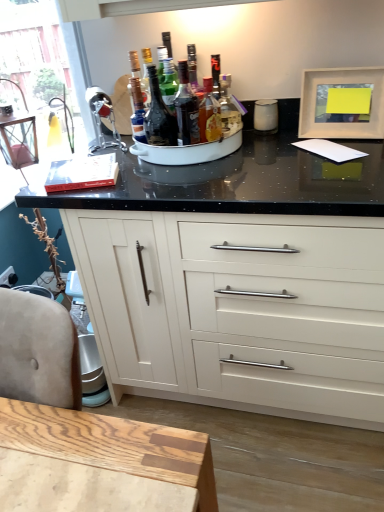
Question: Is translucent glass bottle at center, which is the 1th bottle in left-to-right order, at the left side of shiny dark glass bottle at center, marked as the second bottle in a left-to-right arrangement?

Choices:
 (A) yes
 (B) no

Answer: (A)

Question: Can we say translucent glass bottle at center, which is the 1th bottle in left-to-right order, lies outside shiny dark glass bottle at center, the second bottle positioned from the right?

Choices:
 (A) no
 (B) yes

Answer: (B)

Question: Can shiny dark glass bottle at center, marked as the second bottle in a left-to-right arrangement, be found inside translucent glass bottle at center, which is the 1th bottle in left-to-right order?

Choices:
 (A) yes
 (B) no

Answer: (B)

Question: Is translucent glass bottle at center, which is the 1th bottle in left-to-right order, not near shiny dark glass bottle at center, marked as the second bottle in a left-to-right arrangement?

Choices:
 (A) no
 (B) yes

Answer: (A)

Question: Is shiny dark glass bottle at center, the second bottle positioned from the right, at the back of translucent glass bottle at center, which is the 3th bottle from right to left?

Choices:
 (A) no
 (B) yes

Answer: (A)

Question: From the image's perspective, is white matte cabinet at center positioned above or below matte white picture frame at upper right?

Choices:
 (A) above
 (B) below

Answer: (B)

Question: Relative to matte white picture frame at upper right, is white matte cabinet at center in front or behind?

Choices:
 (A) behind
 (B) front

Answer: (B)

Question: Is white matte cabinet at center inside the boundaries of matte white picture frame at upper right, or outside?

Choices:
 (A) outside
 (B) inside

Answer: (A)

Question: From a real-world perspective, is white matte cabinet at center positioned above or below matte white picture frame at upper right?

Choices:
 (A) above
 (B) below

Answer: (B)

Question: From a real-world perspective, is matte white picture frame at upper right physically located above or below translucent glass bottle at center, which is the 3th bottle from right to left?

Choices:
 (A) below
 (B) above

Answer: (A)

Question: In terms of width, does matte white picture frame at upper right look wider or thinner when compared to translucent glass bottle at center, which is the 1th bottle in left-to-right order?

Choices:
 (A) thin
 (B) wide

Answer: (B)

Question: From the image's perspective, is matte white picture frame at upper right above or below translucent glass bottle at center, which is the 1th bottle in left-to-right order?

Choices:
 (A) below
 (B) above

Answer: (B)

Question: In the image, is matte white picture frame at upper right on the left side or the right side of translucent glass bottle at center, which is the 3th bottle from right to left?

Choices:
 (A) right
 (B) left

Answer: (A)

Question: From a real-world perspective, is translucent glass bottle at center, which is the 3th bottle from right to left, above or below translucent glass bottle at center, the 3th bottle in the left-to-right sequence?

Choices:
 (A) above
 (B) below

Answer: (A)

Question: Considering the relative positions of translucent glass bottle at center, which is the 3th bottle from right to left, and translucent glass bottle at center, the 3th bottle in the left-to-right sequence, in the image provided, is translucent glass bottle at center, which is the 3th bottle from right to left, to the left or to the right of translucent glass bottle at center, the 3th bottle in the left-to-right sequence,?

Choices:
 (A) left
 (B) right

Answer: (A)